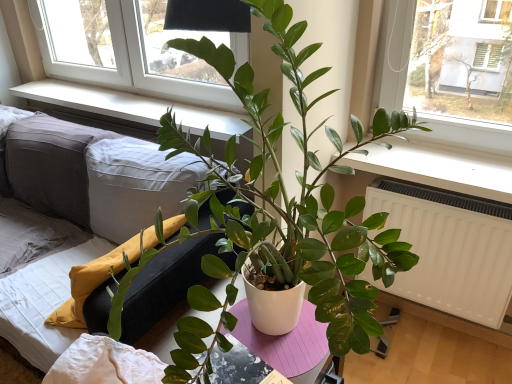
This screenshot has height=384, width=512. What do you see at coordinates (132, 107) in the screenshot?
I see `white smooth window sill at upper center` at bounding box center [132, 107].

What are the coordinates of `white matte pot at center` in the screenshot? It's located at (275, 211).

Is white matte pot at center to the right of gray fabric couch at center from the viewer's perspective?

Yes, white matte pot at center is to the right of gray fabric couch at center.

In the scene shown: Is white matte pot at center positioned before gray fabric couch at center?

That is True.

From the picture: Which of these two, white matte pot at center or gray fabric couch at center, is smaller?

white matte pot at center is smaller.

How distant is white matte pot at center from gray fabric couch at center?

20.58 inches.

Is white smooth window sill at upper center at the left side of white matte radiator at lower right?

Yes, white smooth window sill at upper center is to the left of white matte radiator at lower right.

Which of these two, white smooth window sill at upper center or white matte radiator at lower right, is bigger?

white matte radiator at lower right.

Is white smooth window sill at upper center facing towards white matte radiator at lower right?

No, white smooth window sill at upper center is not oriented towards white matte radiator at lower right.

Does white smooth window sill at upper center lie behind gray fabric couch at center?

Yes, white smooth window sill at upper center is further from the viewer.

How many degrees apart are the facing directions of white smooth window sill at upper center and gray fabric couch at center?

1.32 degrees separate the facing orientations of white smooth window sill at upper center and gray fabric couch at center.

Is white smooth window sill at upper center bigger than gray fabric couch at center?

No.

Visually, is white smooth window sill at upper center positioned to the left or to the right of gray fabric couch at center?

white smooth window sill at upper center is positioned on gray fabric couch at center's right side.

From the image's perspective, would you say gray fabric couch at center is shown under white matte radiator at lower right?

A: No, from the image's perspective, gray fabric couch at center is not beneath white matte radiator at lower right.

At what (x,y) coordinates should I click in order to perform the action: click on radiator above the gray fabric couch at center (from a real-world perspective). Please return your answer as a coordinate pair (x, y). Looking at the image, I should click on (450, 248).

Based on the photo, is gray fabric couch at center spatially inside white matte radiator at lower right, or outside of it?

gray fabric couch at center lies outside white matte radiator at lower right.

Is white matte radiator at lower right inside or outside of white smooth window sill at upper center?

white matte radiator at lower right is not enclosed by white smooth window sill at upper center.

Is white smooth window sill at upper center at the back of white matte radiator at lower right?

No, white matte radiator at lower right is not facing away from white smooth window sill at upper center.

Based on their sizes in the image, would you say white matte radiator at lower right is bigger or smaller than white smooth window sill at upper center?

white matte radiator at lower right is bigger than white smooth window sill at upper center.

Is white matte radiator at lower right to the left of white smooth window sill at upper center from the viewer's perspective?

In fact, white matte radiator at lower right is to the right of white smooth window sill at upper center.

Measure the distance from white matte pot at center to white smooth window sill at upper center.

1.03 meters.

From a real-world perspective, is white matte pot at center over white smooth window sill at upper center?

Yes, from a real-world perspective, white matte pot at center is above white smooth window sill at upper center.

Which of these two, white matte pot at center or white smooth window sill at upper center, is smaller?

white smooth window sill at upper center.

Considering the positions of objects white matte pot at center and white smooth window sill at upper center in the image provided, who is behind, white matte pot at center or white smooth window sill at upper center?

white smooth window sill at upper center.

In the scene shown: Is white smooth window sill at upper center positioned with its back to white matte pot at center?

That's not correct — white smooth window sill at upper center is not looking away from white matte pot at center.

Is white smooth window sill at upper center not within white matte pot at center?

Yes, white smooth window sill at upper center is located beyond the bounds of white matte pot at center.

Who is taller, white smooth window sill at upper center or white matte pot at center?

white matte pot at center.

From a real-world perspective, which object stands above the other?

From a 3D spatial view, white matte pot at center is above.

At what (x,y) coordinates should I click in order to perform the action: click on houseplant on the right side of gray fabric couch at center. Please return your answer as a coordinate pair (x, y). The width and height of the screenshot is (512, 384). Looking at the image, I should click on (275, 211).

Identify the location of radiator below the white smooth window sill at upper center (from the image's perspective). This screenshot has height=384, width=512. (450, 248).

Based on their spatial positions, is white smooth window sill at upper center or white matte pot at center further from white matte radiator at lower right?

Based on the image, white smooth window sill at upper center appears to be further to white matte radiator at lower right.

Estimate the real-world distances between objects in this image. Which object is closer to gray fabric couch at center, white matte radiator at lower right or white smooth window sill at upper center?

white smooth window sill at upper center is closer to gray fabric couch at center.

Looking at the image, which one is located closer to white smooth window sill at upper center, white matte pot at center or white matte radiator at lower right?

Based on the image, white matte pot at center appears to be nearer to white smooth window sill at upper center.

Looking at the image, which one is located closer to gray fabric couch at center, white matte pot at center or white matte radiator at lower right?

white matte pot at center is positioned closer to the anchor gray fabric couch at center.

Estimate the real-world distances between objects in this image. Which object is closer to gray fabric couch at center, white matte radiator at lower right or white matte pot at center?

The object closer to gray fabric couch at center is white matte pot at center.

Estimate the real-world distances between objects in this image. Which object is closer to white smooth window sill at upper center, white matte radiator at lower right or gray fabric couch at center?

Among the two, gray fabric couch at center is located nearer to white smooth window sill at upper center.

Looking at the image, which one is located further to white matte pot at center, gray fabric couch at center or white smooth window sill at upper center?

white smooth window sill at upper center lies further to white matte pot at center than the other object.

Which object lies further to the anchor point gray fabric couch at center, white smooth window sill at upper center or white matte pot at center?

white matte pot at center lies further to gray fabric couch at center than the other object.

The height and width of the screenshot is (384, 512). I want to click on window sill between gray fabric couch at center and white matte radiator at lower right from left to right, so coord(132,107).

Find the location of a particular element. Image resolution: width=512 pixels, height=384 pixels. studio couch between white matte pot at center and white smooth window sill at upper center from front to back is located at coordinates [x=94, y=171].

Where is `radiator between white matte pot at center and white smooth window sill at upper center along the z-axis`? This screenshot has width=512, height=384. radiator between white matte pot at center and white smooth window sill at upper center along the z-axis is located at coordinates (450, 248).

The width and height of the screenshot is (512, 384). I want to click on houseplant between gray fabric couch at center and white matte radiator at lower right in the horizontal direction, so click(x=275, y=211).